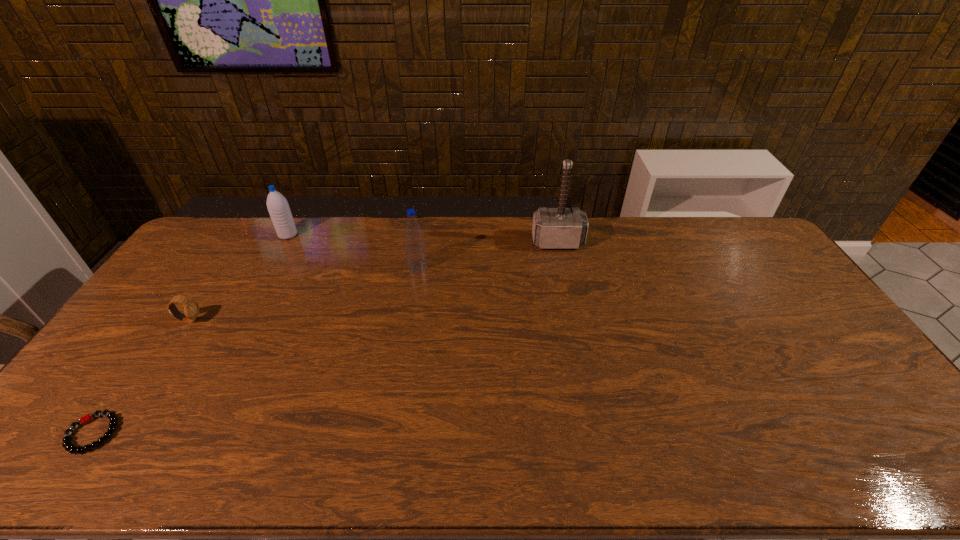
Locate an element on the screen. object located at the near left corner is located at coordinates (67, 443).

This screenshot has width=960, height=540. In order to click on free space at the far edge of the desktop in this screenshot , I will do `click(600, 234)`.

At what (x,y) coordinates should I click in order to perform the action: click on vacant space at the near edge. Please return your answer as a coordinate pair (x, y). The width and height of the screenshot is (960, 540). Looking at the image, I should click on (726, 447).

In the image, there is a desktop. At what (x,y) coordinates should I click in order to perform the action: click on vacant space at the left edge. Please return your answer as a coordinate pair (x, y). Looking at the image, I should click on (130, 395).

Identify the location of vacant area at the near left corner of the desktop. Image resolution: width=960 pixels, height=540 pixels. (60, 441).

Image resolution: width=960 pixels, height=540 pixels. Find the location of `free space at the far right corner of the desktop`. free space at the far right corner of the desktop is located at coordinates (751, 254).

Find the location of a particular element. This screenshot has height=540, width=960. free space between the bracelet and the rightmost object is located at coordinates (325, 338).

At what (x,y) coordinates should I click in order to perform the action: click on free space between the hammer and the nearest object. Please return your answer as a coordinate pair (x, y). Looking at the image, I should click on (325, 338).

Where is `vacant space in between the hammer and the bracelet`? This screenshot has width=960, height=540. vacant space in between the hammer and the bracelet is located at coordinates (325, 338).

Find the location of `unoccupied position between the left water bottle and the third nearest object`. unoccupied position between the left water bottle and the third nearest object is located at coordinates click(x=352, y=251).